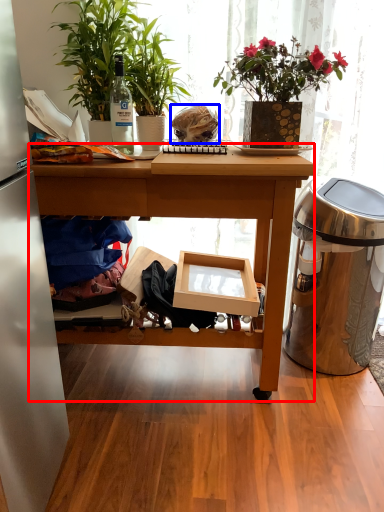
Question: Which point is closer to the camera, desk (highlighted by a red box) or food (highlighted by a blue box)?

Choices:
 (A) desk
 (B) food

Answer: (A)